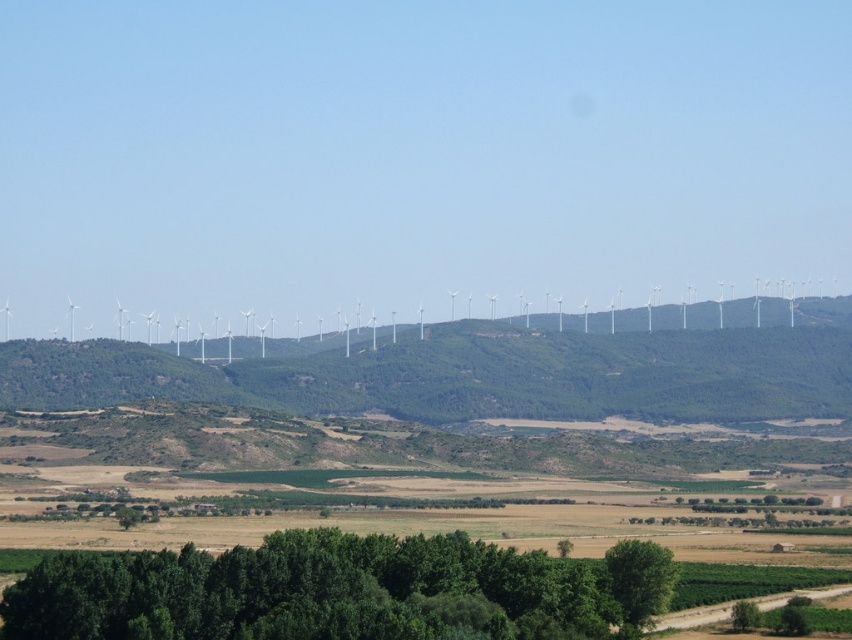
Does green leafy trees at lower center lie behind green leafy tree at lower center?

No.

Between green leafy trees at lower center and green leafy tree at lower center, which one is positioned lower?

green leafy tree at lower center

Is point (492, 548) closer to camera compared to point (611, 580)?

Yes, it is in front of point (611, 580).

Where is `green leafy trees at lower center`? green leafy trees at lower center is located at coordinates (337, 589).

Based on the photo, is green leafy trees at lower center thinner than white plastic wind turbines at center?

Correct, green leafy trees at lower center's width is less than white plastic wind turbines at center's.

Is green leafy trees at lower center further to the viewer compared to white plastic wind turbines at center?

No, green leafy trees at lower center is closer to the viewer.

The image size is (852, 640). Find the location of `green leafy trees at lower center`. green leafy trees at lower center is located at coordinates (337, 589).

Where is `white plastic wind turbines at center`? This screenshot has height=640, width=852. white plastic wind turbines at center is located at coordinates pos(714,316).

Is white plastic wind turbines at center smaller than green leafy tree at lower center?

Incorrect, white plastic wind turbines at center is not smaller in size than green leafy tree at lower center.

What are the coordinates of `white plastic wind turbines at center` in the screenshot? It's located at (714, 316).